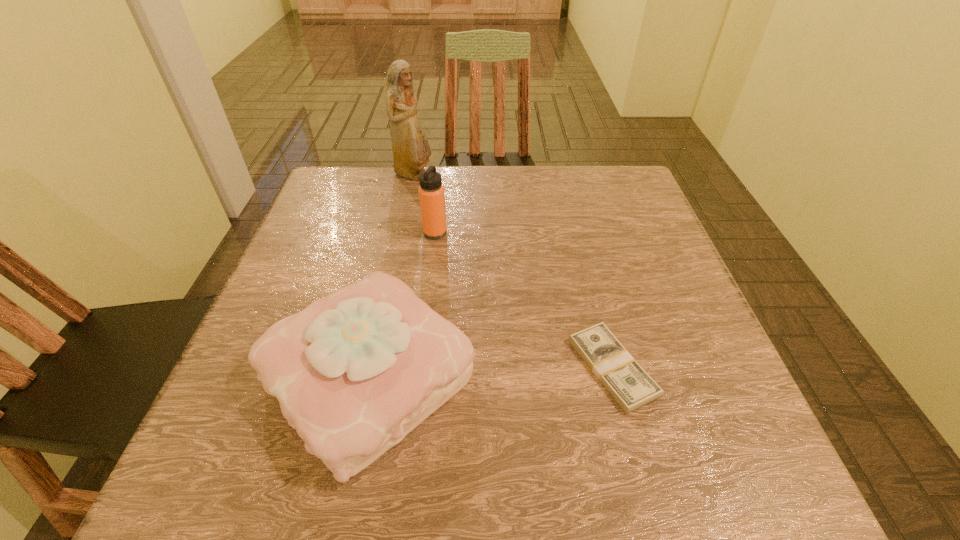
Where is `free location located 0.060m on the right of the rightmost object`? This screenshot has width=960, height=540. free location located 0.060m on the right of the rightmost object is located at coordinates (687, 368).

Identify the location of object that is at the far edge. click(411, 151).

Identify the location of object located in the near edge section of the desktop. This screenshot has width=960, height=540. (354, 372).

Where is `object that is at the left edge`? The height and width of the screenshot is (540, 960). object that is at the left edge is located at coordinates (354, 372).

Find the location of a particular element. The width and height of the screenshot is (960, 540). object that is at the right edge is located at coordinates (628, 383).

Image resolution: width=960 pixels, height=540 pixels. Identify the location of object positioned at the near left corner. (354, 372).

In the image, there is a desktop. What are the coordinates of `vacant space at the far edge` in the screenshot? It's located at (453, 208).

At what (x,y) coordinates should I click in order to perform the action: click on vacant space at the near edge. Please return your answer as a coordinate pair (x, y). The height and width of the screenshot is (540, 960). Looking at the image, I should click on (431, 492).

Find the location of a particular element. The height and width of the screenshot is (540, 960). vacant region at the right edge of the desktop is located at coordinates (652, 233).

The image size is (960, 540). Find the location of `free space at the far left corner of the desktop`. free space at the far left corner of the desktop is located at coordinates (345, 218).